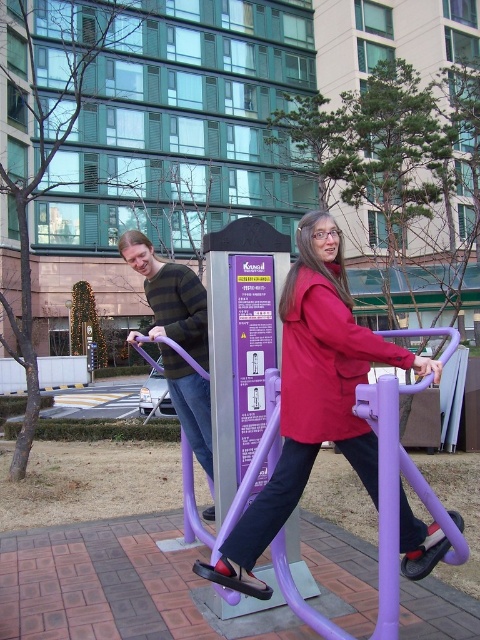
Question: Among these points, which one is nearest to the camera?

Choices:
 (A) (387, 616)
 (B) (177, 275)
 (C) (336, 428)

Answer: (A)

Question: Which object is positioned farthest from the knitted sweater at left?

Choices:
 (A) purple plastic exercise machine at center
 (B) striped sweater at center
 (C) matte red jacket at center

Answer: (B)

Question: Which point is farther to the camera?

Choices:
 (A) matte red jacket at center
 (B) knitted sweater at left
 (C) purple plastic exercise machine at center

Answer: (B)

Question: From the image, what is the correct spatial relationship of matte red jacket at center in relation to striped sweater at center?

Choices:
 (A) left
 (B) right

Answer: (B)

Question: Does striped sweater at center come in front of knitted sweater at left?

Choices:
 (A) yes
 (B) no

Answer: (A)

Question: Is matte red jacket at center thinner than striped sweater at center?

Choices:
 (A) yes
 (B) no

Answer: (A)